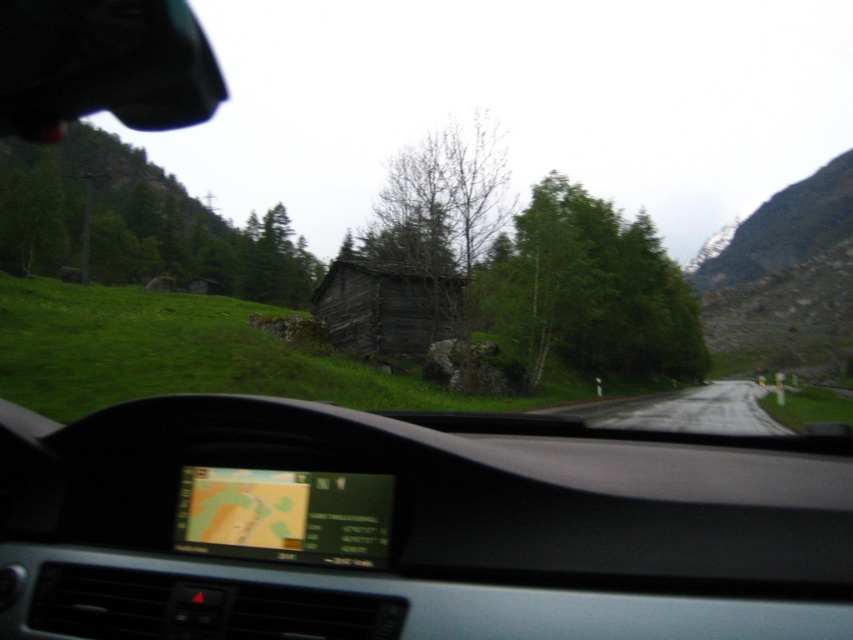
Which is behind, point (403, 566) or point (405, 180)?

The point (405, 180) is more distant.

What are the coordinates of `transparent glass windshield at center` in the screenshot? It's located at (412, 528).

Is transparent glass windshield at center to the left of gray asphalt road at center from the viewer's perspective?

Indeed, transparent glass windshield at center is positioned on the left side of gray asphalt road at center.

Who is taller, transparent glass windshield at center or gray asphalt road at center?

gray asphalt road at center

Does point (438, 520) lie behind point (660, 420)?

No, it is in front of (660, 420).

Where is `transparent glass windshield at center`? The image size is (853, 640). transparent glass windshield at center is located at coordinates (412, 528).

Is the position of bare wood tree at center more distant than that of dark brown wooden log cabin at center?

No.

Between bare wood tree at center and dark brown wooden log cabin at center, which one is positioned higher?

bare wood tree at center is higher up.

I want to click on bare wood tree at center, so click(444, 221).

Where is `bare wood tree at center`? Image resolution: width=853 pixels, height=640 pixels. bare wood tree at center is located at coordinates coord(444,221).